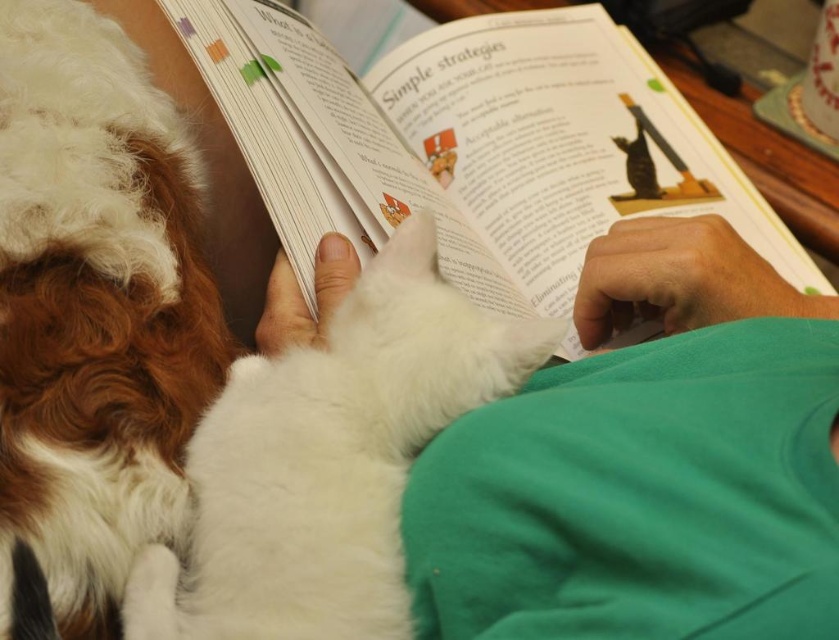
Question: Is white paper at center behind white fluffy cat at center?

Choices:
 (A) yes
 (B) no

Answer: (A)

Question: Is white paper at center bigger than white fluffy cat at center?

Choices:
 (A) no
 (B) yes

Answer: (B)

Question: Among these points, which one is farthest from the camera?

Choices:
 (A) (386, 182)
 (B) (791, 305)
 (C) (374, 548)
 (D) (103, 80)

Answer: (A)

Question: Where is white paper at center located in relation to white fur cat at center in the image?

Choices:
 (A) above
 (B) below

Answer: (A)

Question: Which object appears closest to the camera in this image?

Choices:
 (A) brown and white fur at left
 (B) white fur cat at center

Answer: (B)

Question: Which of the following is the closest to the observer?

Choices:
 (A) white paper at center
 (B) white fur cat at center

Answer: (B)